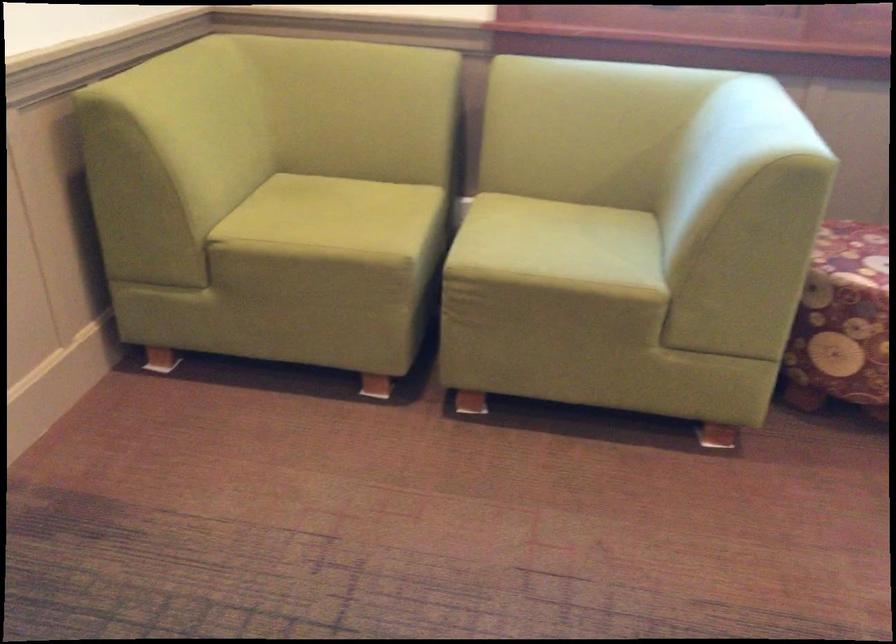
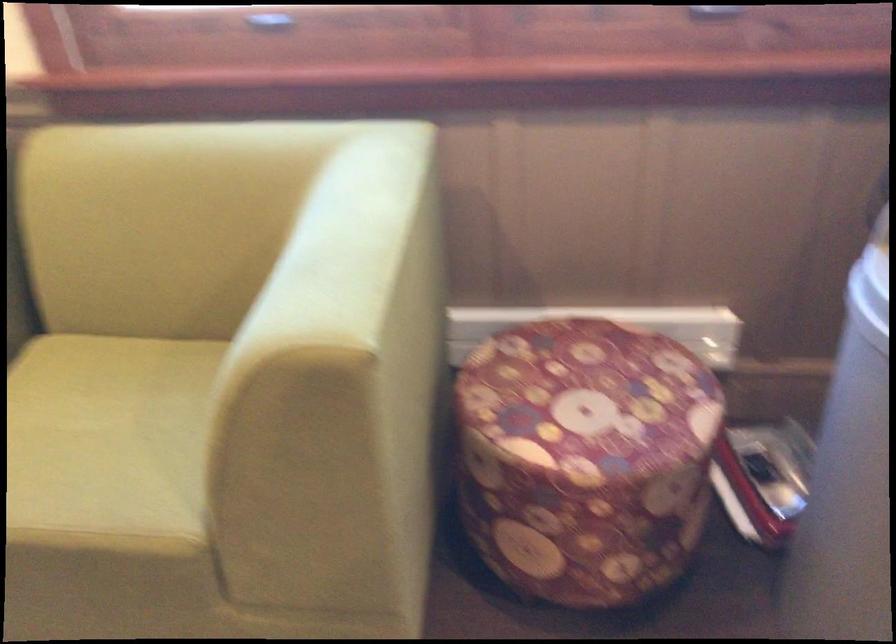
In the second image, find the point that corresponds to point (778, 107) in the first image.

(358, 223)